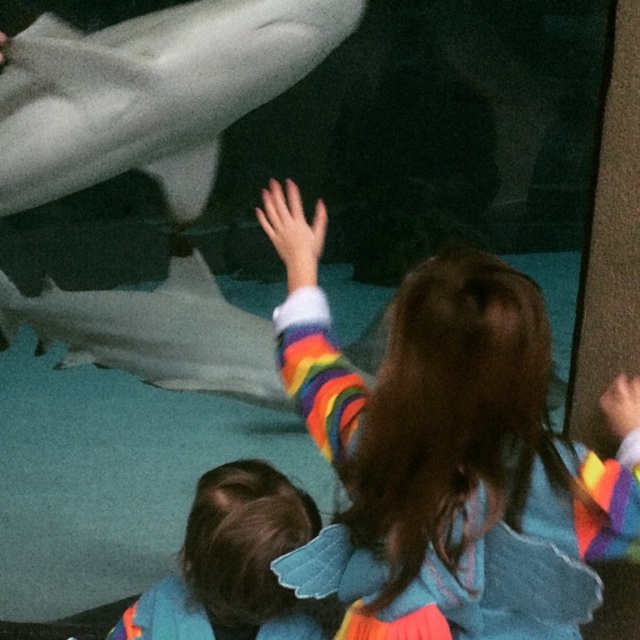
Question: Does white smooth shark at upper left have a smaller size compared to white smooth shark at lower left?

Choices:
 (A) yes
 (B) no

Answer: (B)

Question: Is rainbow fabric dress at center smaller than rainbow striped sweater at lower left?

Choices:
 (A) no
 (B) yes

Answer: (A)

Question: Estimate the real-world distances between objects in this image. Which object is closer to the white smooth shark at upper left?

Choices:
 (A) white smooth shark at lower left
 (B) rainbow fabric dress at center

Answer: (B)

Question: Which is farther from the white smooth shark at upper left?

Choices:
 (A) rainbow striped sweater at lower left
 (B) rainbow fabric dress at center
 (C) white smooth shark at lower left

Answer: (C)

Question: Estimate the real-world distances between objects in this image. Which object is farther from the white smooth shark at upper left?

Choices:
 (A) rainbow striped sweater at lower left
 (B) white smooth shark at lower left

Answer: (B)

Question: Where is rainbow fabric dress at center located in relation to white smooth shark at lower left in the image?

Choices:
 (A) right
 (B) left

Answer: (A)